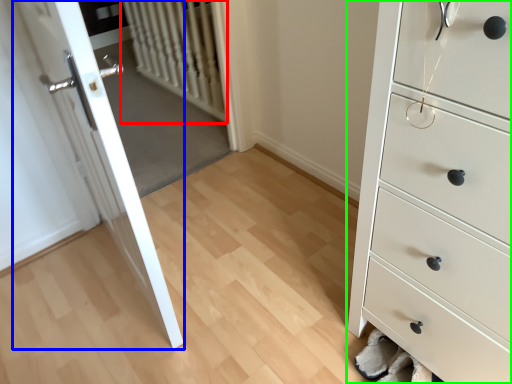
Question: Which is nearer to the radiator (highlighted by a red box)? door (highlighted by a blue box) or chest of drawers (highlighted by a green box).

Choices:
 (A) door
 (B) chest of drawers

Answer: (A)